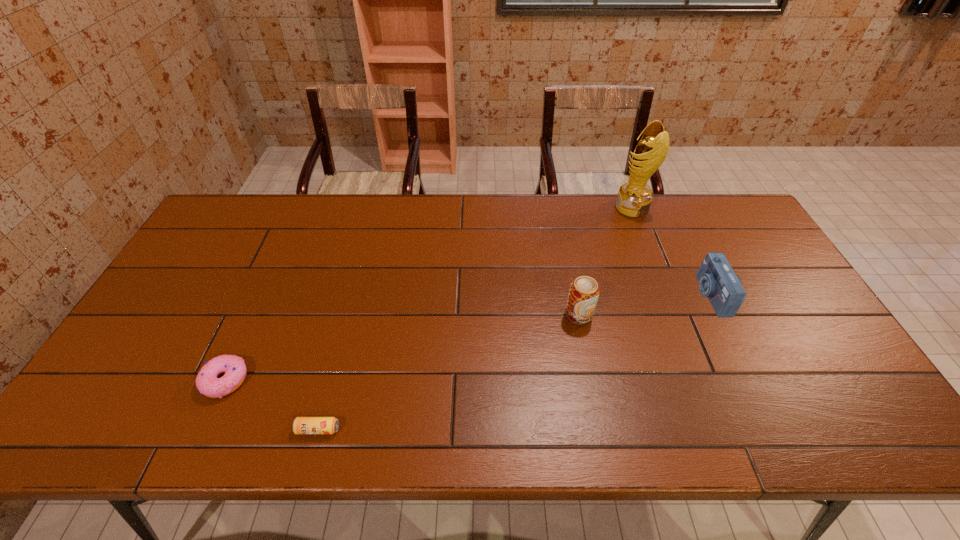
The image size is (960, 540). I want to click on vacant region located on the front-facing side of the second object from right to left, so click(x=553, y=207).

I want to click on free space located on the front-facing side of the second object from right to left, so click(544, 207).

Locate an element on the screen. The height and width of the screenshot is (540, 960). blank space located 0.170m on the front-facing side of the second object from right to left is located at coordinates (567, 207).

The width and height of the screenshot is (960, 540). I want to click on free space located 0.220m on the right of the farther beer can, so pos(673,315).

Locate an element on the screen. The image size is (960, 540). vacant area located 0.350m on the lens of the third shortest object is located at coordinates (578, 295).

I want to click on free region located 0.080m on the lens of the third shortest object, so click(672, 295).

Image resolution: width=960 pixels, height=540 pixels. In order to click on vacant region located on the lens of the third shortest object in this screenshot , I will do `click(564, 295)`.

The image size is (960, 540). Find the location of `vacant space located on the right of the fourth tallest object`. vacant space located on the right of the fourth tallest object is located at coordinates (277, 380).

Locate an element on the screen. The width and height of the screenshot is (960, 540). vacant space located on the back of the shortest object is located at coordinates (347, 323).

This screenshot has width=960, height=540. Identify the location of object that is at the far edge. (634, 198).